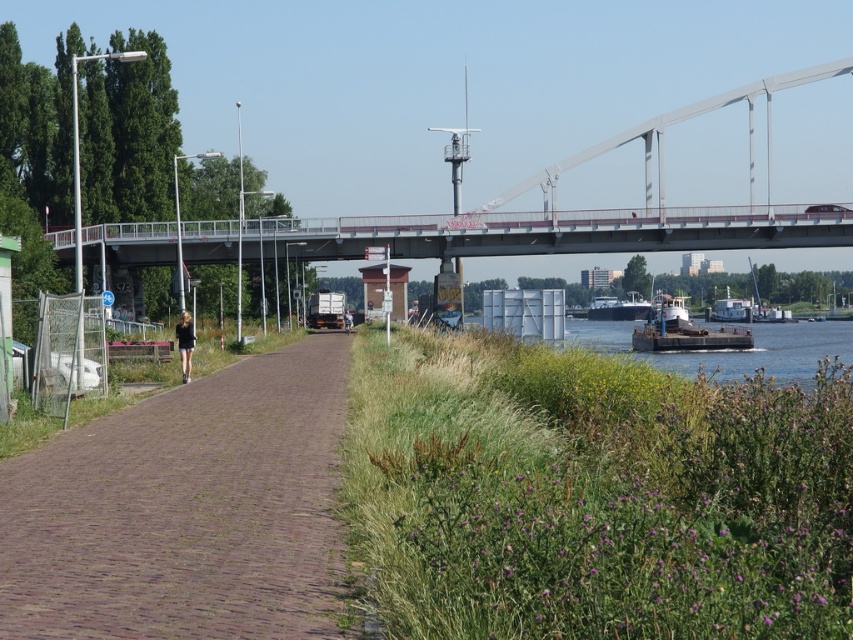
Question: Which object is closer to the camera taking this photo?

Choices:
 (A) concrete bridge at center
 (B) brown wooden barge at lower right
 (C) brown cobblestone path at center
 (D) dark gray metallic barge at lower center

Answer: (C)

Question: Does brown cobblestone path at center come in front of dark gray metallic barge at lower center?

Choices:
 (A) yes
 (B) no

Answer: (A)

Question: Can you confirm if metallic gray bridge at upper center is smaller than brown wooden barge at lower right?

Choices:
 (A) no
 (B) yes

Answer: (A)

Question: Which is nearer to the brown cobblestone path at center?

Choices:
 (A) concrete bridge at center
 (B) metallic gray bridge at upper center
 (C) white matte barge at lower right

Answer: (A)

Question: Which object appears farthest from the camera in this image?

Choices:
 (A) concrete bridge at center
 (B) brown cobblestone path at center

Answer: (A)

Question: Does concrete bridge at center have a lesser width compared to brown wooden barge at lower right?

Choices:
 (A) no
 (B) yes

Answer: (B)